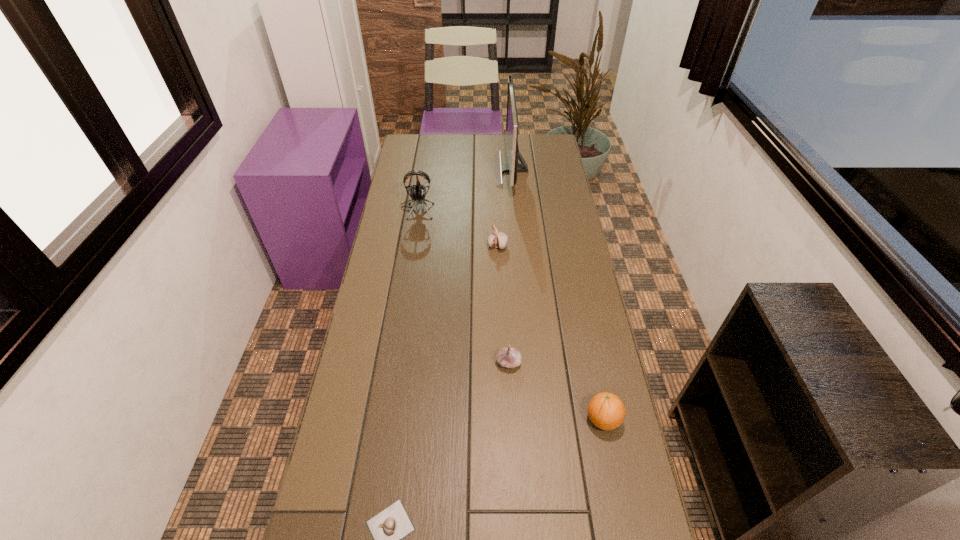
In the image, there is a desktop. At what (x,y) coordinates should I click in order to perform the action: click on vacant region at the right edge. Please return your answer as a coordinate pair (x, y). Looking at the image, I should click on (559, 324).

The width and height of the screenshot is (960, 540). Identify the location of free location at the far left corner of the desktop. tap(431, 152).

Where is `vacant area that lies between the fourth nearest object and the earphone`? vacant area that lies between the fourth nearest object and the earphone is located at coordinates (457, 227).

Find the location of a particular element. free area in between the tallest object and the farthest garlic is located at coordinates pyautogui.click(x=505, y=208).

This screenshot has height=540, width=960. I want to click on vacant area that lies between the monitor and the earphone, so click(465, 190).

Identify the location of vacant area that lies between the third nearest object and the earphone. (463, 286).

Identify the location of free space that is in between the fourth farthest object and the third farthest object. (503, 304).

At what (x,y) coordinates should I click in order to perform the action: click on vacant area that lies between the tallest object and the orange. Please return your answer as a coordinate pair (x, y). The image size is (960, 540). Looking at the image, I should click on (558, 294).

The width and height of the screenshot is (960, 540). I want to click on object that can be found as the closest to the shortest object, so click(509, 357).

The image size is (960, 540). Identify the location of object that ranks as the fourth closest to the fourth nearest object. (606, 411).